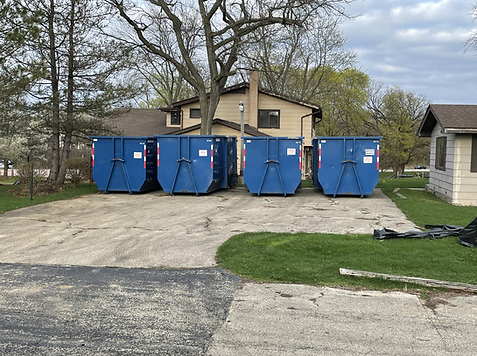
At what (x,y) coordinates should I click in order to perform the action: click on windows. Please return your answer as a coordinate pair (x, y). The height and width of the screenshot is (356, 477). Looking at the image, I should click on (177, 117), (198, 113), (276, 122), (436, 155), (473, 160).